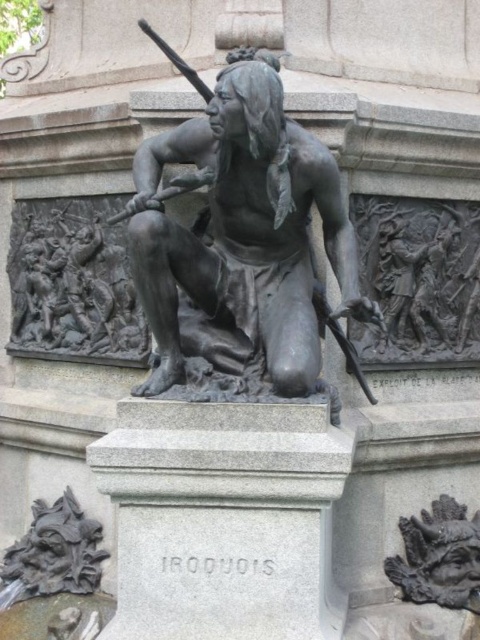
Between bronze statue at center and dark gray stone carving at lower left, which one has less height?

Standing shorter between the two is dark gray stone carving at lower left.

Which is below, bronze statue at center or dark gray stone carving at lower left?

Positioned lower is dark gray stone carving at lower left.

Is point (227, 202) less distant than point (83, 520)?

Yes, it is in front of point (83, 520).

The image size is (480, 640). Identify the location of bronze statue at center. (243, 230).

Can you confirm if dark gray stone carving at lower right is thinner than dark gray stone carving at lower left?

Answer: Correct, dark gray stone carving at lower right's width is less than dark gray stone carving at lower left's.

Which of these two, dark gray stone carving at lower right or dark gray stone carving at lower left, stands shorter?

Standing shorter between the two is dark gray stone carving at lower left.

Between point (469, 524) and point (43, 512), which one is positioned in front?

Point (469, 524) is more forward.

Locate an element on the screen. The image size is (480, 640). dark gray stone carving at lower right is located at coordinates (439, 556).

Does dark gray bas-relief battle scene at lower left have a smaller size compared to dark gray stone carving at lower right?

No, dark gray bas-relief battle scene at lower left is not smaller than dark gray stone carving at lower right.

Does dark gray bas-relief battle scene at lower left have a larger size compared to dark gray stone carving at lower right?

Indeed, dark gray bas-relief battle scene at lower left has a larger size compared to dark gray stone carving at lower right.

Image resolution: width=480 pixels, height=640 pixels. What do you see at coordinates (72, 284) in the screenshot?
I see `dark gray bas-relief battle scene at lower left` at bounding box center [72, 284].

Locate an element on the screen. This screenshot has width=480, height=640. dark gray bas-relief battle scene at lower left is located at coordinates (72, 284).